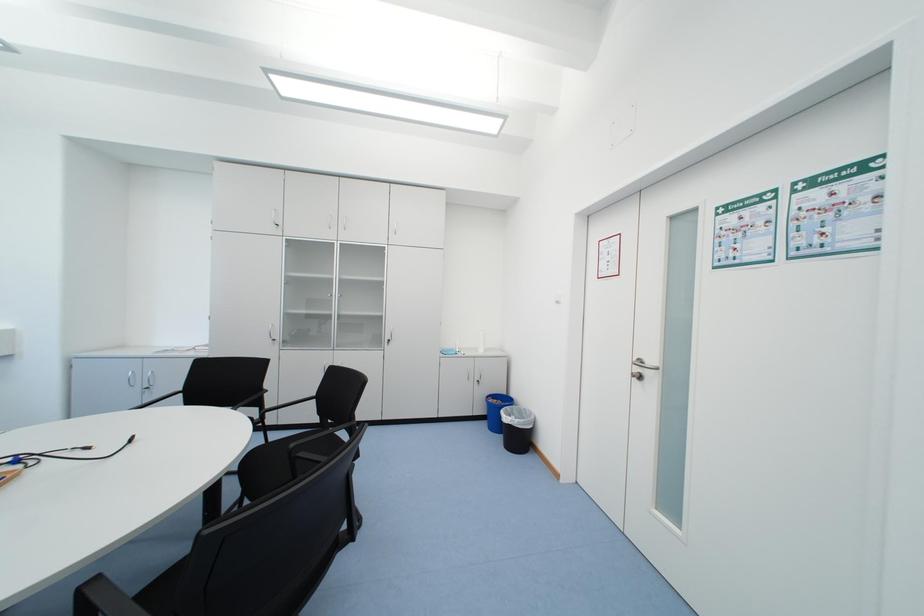
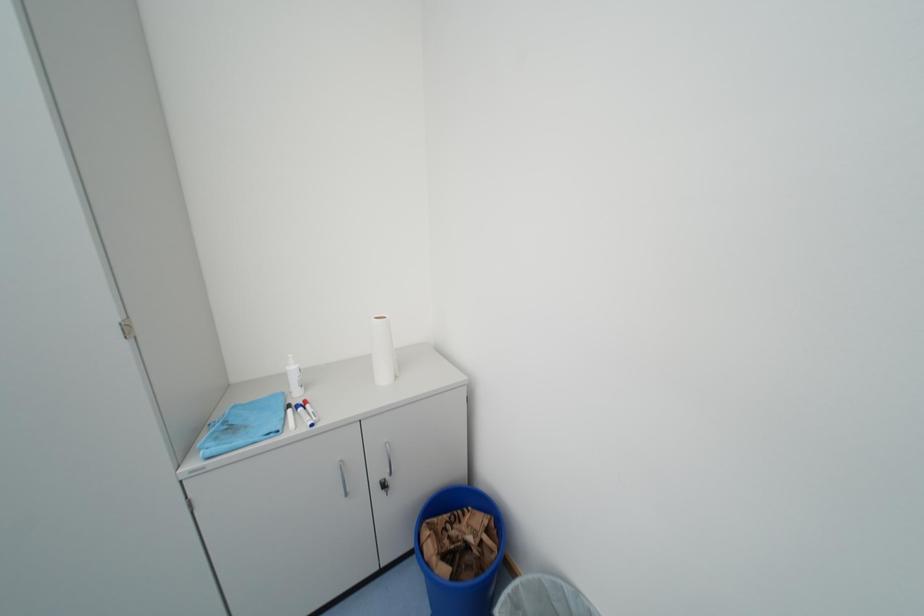
Question: What movement of the cameraman would produce the second image?

Choices:
 (A) Left
 (B) Right
 (C) Forward
 (D) Backward

Answer: (C)